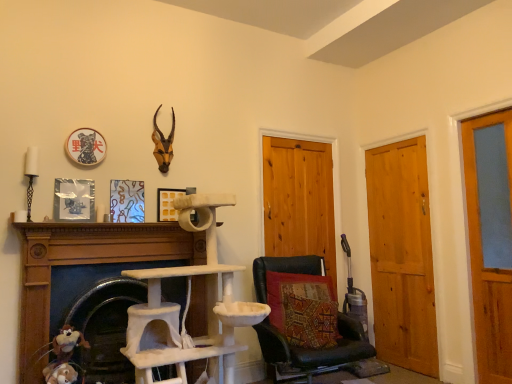
Question: Does fuzzy fabric stuffed animal at lower left contain wooden door at center, acting as the first door starting from the left?

Choices:
 (A) no
 (B) yes

Answer: (A)

Question: From a real-world perspective, is fuzzy fabric stuffed animal at lower left located beneath wooden door at center, acting as the first door starting from the left?

Choices:
 (A) yes
 (B) no

Answer: (A)

Question: From the image's perspective, would you say fuzzy fabric stuffed animal at lower left is shown under wooden door at center, the third door in the right-to-left sequence?

Choices:
 (A) yes
 (B) no

Answer: (A)

Question: From a real-world perspective, does fuzzy fabric stuffed animal at lower left stand above wooden door at center, the third door in the right-to-left sequence?

Choices:
 (A) no
 (B) yes

Answer: (A)

Question: Is fuzzy fabric stuffed animal at lower left further to the viewer compared to wooden door at center, the third door in the right-to-left sequence?

Choices:
 (A) no
 (B) yes

Answer: (A)

Question: In terms of height, does white textured cat tree at center, the first fireplace viewed from the left, look taller or shorter compared to wooden door at center, the third door in the right-to-left sequence?

Choices:
 (A) short
 (B) tall

Answer: (A)

Question: Would you say white textured cat tree at center, which ranks as the 2th fireplace in right-to-left order, is inside or outside wooden door at center, acting as the first door starting from the left?

Choices:
 (A) inside
 (B) outside

Answer: (B)

Question: Considering their positions, is white textured cat tree at center, which ranks as the 2th fireplace in right-to-left order, located in front of or behind wooden door at center, acting as the first door starting from the left?

Choices:
 (A) behind
 (B) front

Answer: (B)

Question: Is point (31, 261) positioned closer to the camera than point (310, 145)?

Choices:
 (A) farther
 (B) closer

Answer: (B)

Question: Considering their positions, is brown matte antlers at upper center located in front of or behind metallic silver picture frame at left, arranged as the 1th picture frame when viewed from the left?

Choices:
 (A) behind
 (B) front

Answer: (A)

Question: From the image's perspective, is brown matte antlers at upper center positioned above or below metallic silver picture frame at left, arranged as the 1th picture frame when viewed from the front?

Choices:
 (A) below
 (B) above

Answer: (B)

Question: Considering the relative positions of brown matte antlers at upper center and metallic silver picture frame at left, arranged as the 1th picture frame when viewed from the left, in the image provided, is brown matte antlers at upper center to the left or to the right of metallic silver picture frame at left, arranged as the 1th picture frame when viewed from the left,?

Choices:
 (A) right
 (B) left

Answer: (A)

Question: Is brown matte antlers at upper center bigger or smaller than metallic silver picture frame at left, arranged as the 1th picture frame when viewed from the left?

Choices:
 (A) big
 (B) small

Answer: (A)

Question: In terms of height, does beige felt cat tree at lower left, the second fireplace in the left-to-right sequence, look taller or shorter compared to brown matte antlers at upper center?

Choices:
 (A) tall
 (B) short

Answer: (A)

Question: In the image, is beige felt cat tree at lower left, the second fireplace in the left-to-right sequence, positioned in front of or behind brown matte antlers at upper center?

Choices:
 (A) front
 (B) behind

Answer: (A)